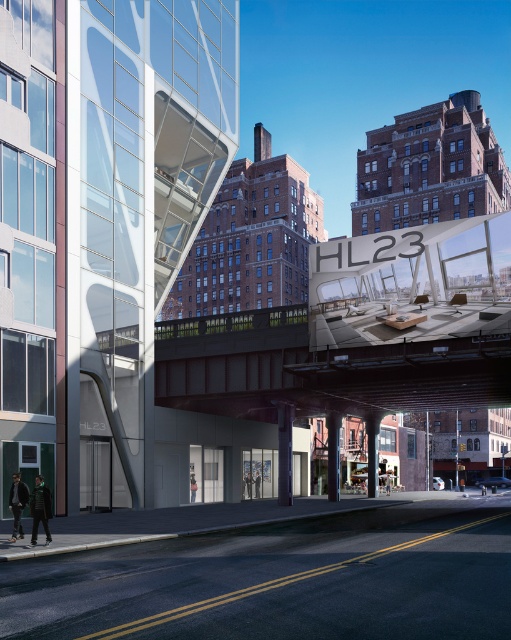
Does dark green jacket at lower left have a larger size compared to dark gray jacket at lower left?

Correct, dark green jacket at lower left is larger in size than dark gray jacket at lower left.

Does dark green jacket at lower left appear on the left side of dark gray jacket at lower left?

No, dark green jacket at lower left is not to the left of dark gray jacket at lower left.

Is point (45, 518) farther from viewer compared to point (25, 493)?

That is False.

Where is `dark green jacket at lower left`? The height and width of the screenshot is (640, 511). dark green jacket at lower left is located at coordinates (39, 509).